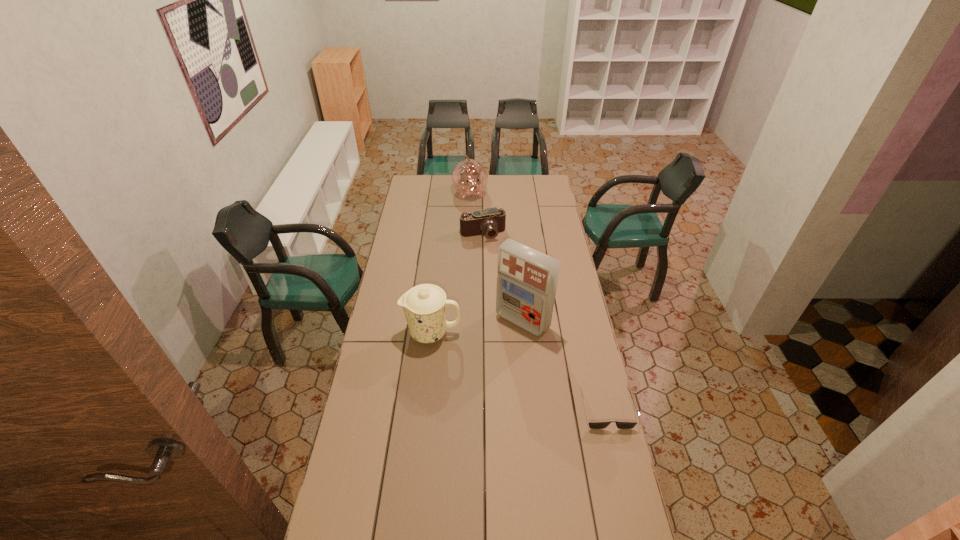
What are the coordinates of `the first-aid kit that is at the right edge` in the screenshot? It's located at (527, 279).

In the image, there is a desktop. Where is `vacant space at the far edge`? vacant space at the far edge is located at coordinates (440, 191).

Locate an element on the screen. free space at the left edge is located at coordinates (400, 228).

At what (x,y) coordinates should I click in order to perform the action: click on vacant space at the right edge of the desktop. Please return your answer as a coordinate pair (x, y). The width and height of the screenshot is (960, 540). Looking at the image, I should click on (553, 235).

You are a GUI agent. You are given a task and a screenshot of the screen. Output one action in this format:
    pyautogui.click(x=<x>, y=<y>)
    Task: Click on the free point between the chinaware and the farthest object
    
    Given the screenshot: What is the action you would take?
    point(451,264)

Locate an element on the screen. This screenshot has height=540, width=960. free space between the tallest object and the chinaware is located at coordinates (477, 327).

What are the coordinates of `vacant region between the second shortest object and the chinaware` in the screenshot? It's located at (457, 284).

Image resolution: width=960 pixels, height=540 pixels. Find the location of `empty location between the second shortest object and the chinaware`. empty location between the second shortest object and the chinaware is located at coordinates (457, 284).

I want to click on vacant space that's between the first-aid kit and the shortest object, so click(564, 366).

I want to click on free space between the first-aid kit and the chinaware, so 477,327.